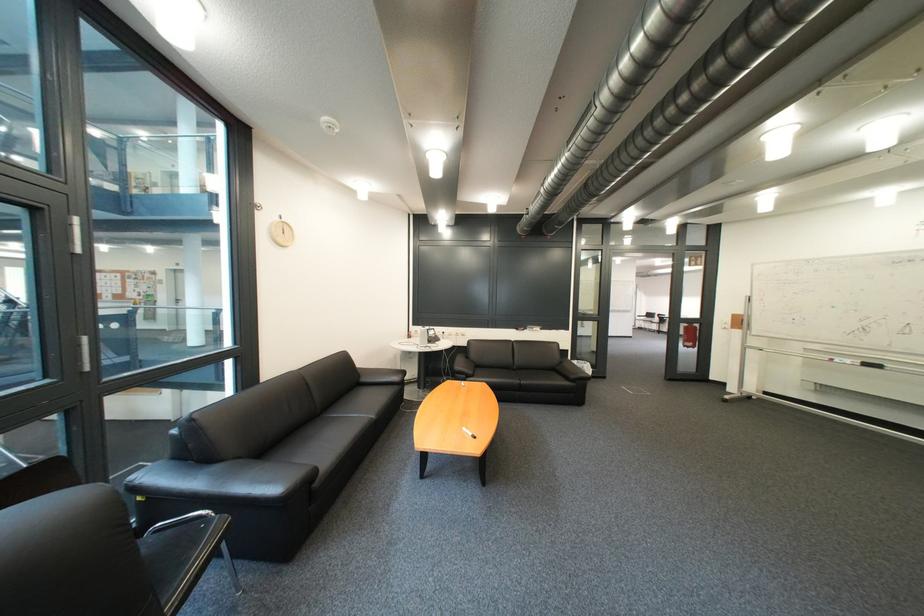
Where is `black sofa sitting surface`? The image size is (924, 616). black sofa sitting surface is located at coordinates (356, 408).